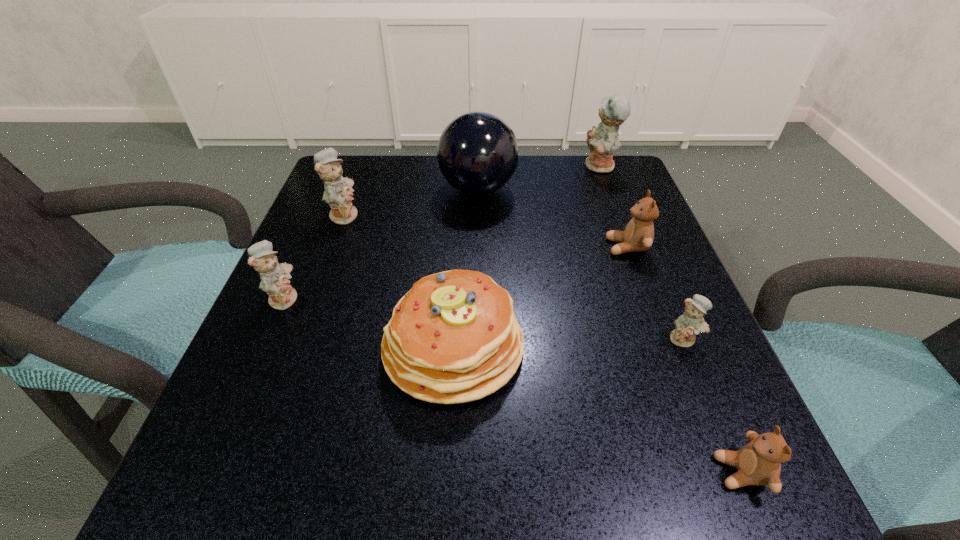
Identify the location of object that ranks as the sixth closest to the pancake. (477, 152).

Where is `object identified as the fourth closest to the pancake`? Image resolution: width=960 pixels, height=540 pixels. object identified as the fourth closest to the pancake is located at coordinates (689, 324).

Locate an element on the screen. The image size is (960, 540). the fourth closest teddy bear to the black bowling ball is located at coordinates (274, 277).

The image size is (960, 540). What are the coordinates of `teddy bear that is the closest to the nearer brown teddy bear` in the screenshot? It's located at (689, 324).

Identify which blue teddy bear is located as the second nearest to the pancake. Please provide its 2D coordinates. Your answer should be formatted as a tuple, i.e. [(x, y)], where the tuple contains the x and y coordinates of a point satisfying the conditions above.

[(338, 194)]

This screenshot has width=960, height=540. I want to click on blue teddy bear identified as the second closest to the third biggest blue teddy bear, so click(689, 324).

Find the location of a particular element. The image size is (960, 540). blank area in the image that satisfies the following two spatial constraints: 1. on the front-facing side of the second farthest blue teddy bear; 2. on the right side of the pancake is located at coordinates (295, 346).

Locate an element on the screen. This screenshot has width=960, height=540. free space that satisfies the following two spatial constraints: 1. on the front-facing side of the second nearest blue teddy bear; 2. on the left side of the pancake is located at coordinates (263, 346).

The image size is (960, 540). In order to click on free spot that satisfies the following two spatial constraints: 1. on the front-facing side of the second farthest blue teddy bear; 2. on the right side of the pancake in this screenshot , I will do `click(295, 346)`.